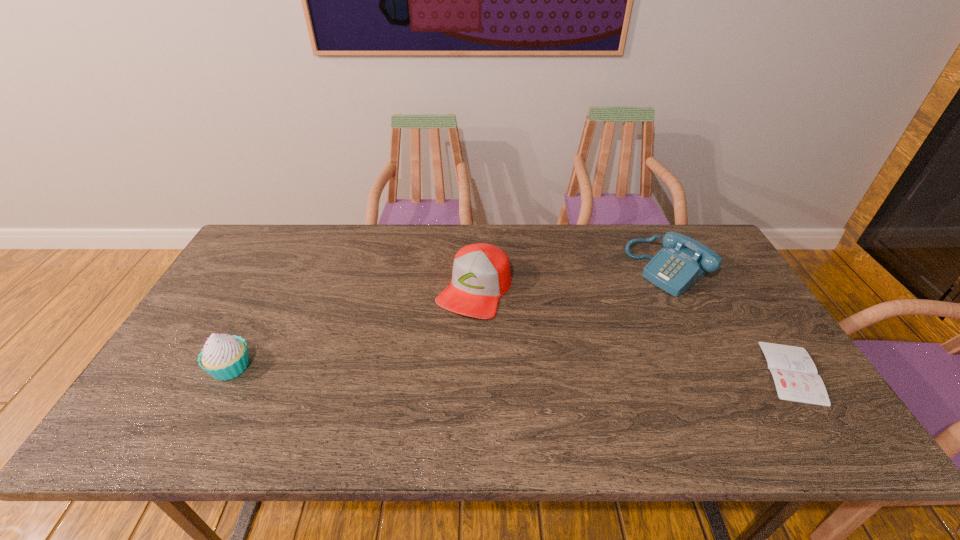
At what (x,y) coordinates should I click in order to perform the action: click on vacant area that lies between the baseball cap and the telephone. Please return your answer as a coordinate pair (x, y). The height and width of the screenshot is (540, 960). Looking at the image, I should click on (571, 279).

Locate an element on the screen. This screenshot has width=960, height=540. free space between the baseball cap and the cupcake is located at coordinates (352, 328).

Where is `vacant space that's between the telephone and the third object from right to left`? The width and height of the screenshot is (960, 540). vacant space that's between the telephone and the third object from right to left is located at coordinates (571, 279).

Find the location of a particular element. This screenshot has width=960, height=540. vacant space that is in between the cupcake and the baseball cap is located at coordinates (352, 328).

This screenshot has width=960, height=540. I want to click on free space between the cupcake and the diary, so click(512, 369).

The image size is (960, 540). In order to click on vacant point located between the cupcake and the diary in this screenshot , I will do `click(512, 369)`.

Locate which object ranks in proximity to the shortest object. Please provide its 2D coordinates. Your answer should be formatted as a tuple, i.e. [(x, y)], where the tuple contains the x and y coordinates of a point satisfying the conditions above.

[(683, 261)]

Locate an element on the screen. the third closest object relative to the baseball cap is located at coordinates [x=795, y=375].

Where is `free spot that satisfies the following two spatial constraints: 1. on the front side of the baseball cap; 2. on the left side of the shortest object`? The width and height of the screenshot is (960, 540). free spot that satisfies the following two spatial constraints: 1. on the front side of the baseball cap; 2. on the left side of the shortest object is located at coordinates (473, 372).